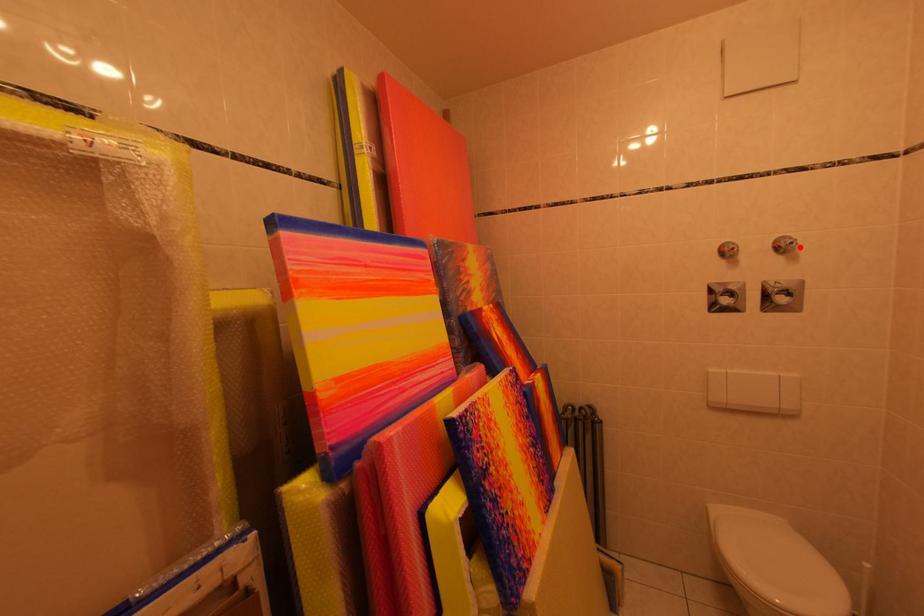
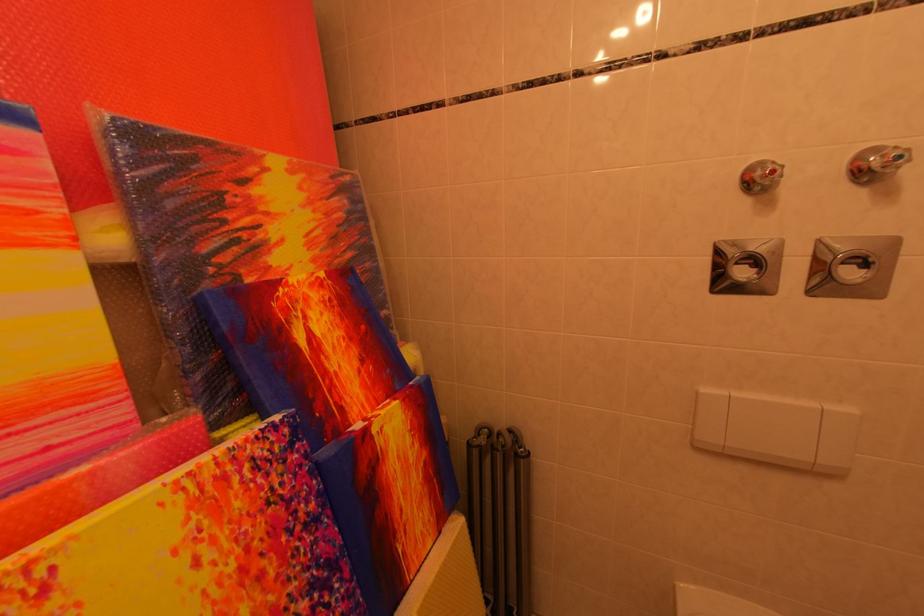
Question: I am providing you with two images of the same scene from different viewpoints. A red point is shown in image1. For the corresponding object point in image2, is it positioned nearer or farther from the camera?

Choices:
 (A) Nearer
 (B) Farther

Answer: (B)